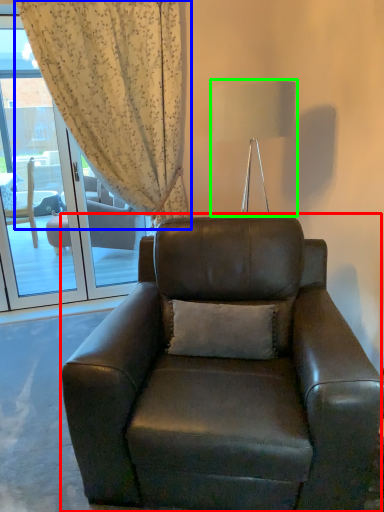
Question: Which object is the closest to the chair (highlighted by a red box)? Choose among these: curtain (highlighted by a blue box) or lamp (highlighted by a green box).

Choices:
 (A) curtain
 (B) lamp

Answer: (B)